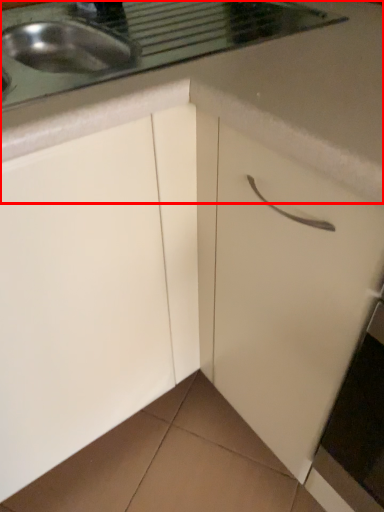
Question: Where is countertop (annotated by the red box) located in relation to drawer in the image?

Choices:
 (A) right
 (B) left

Answer: (B)